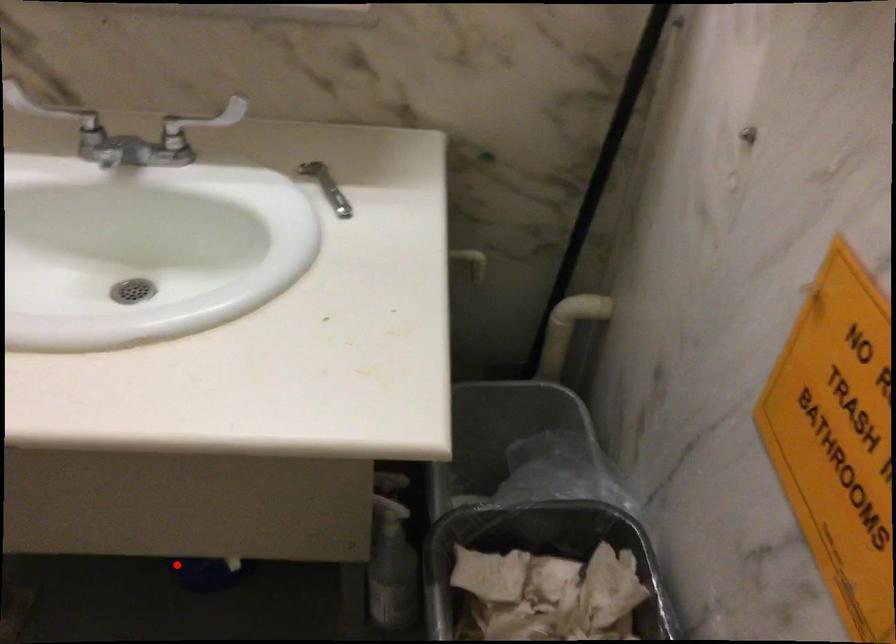
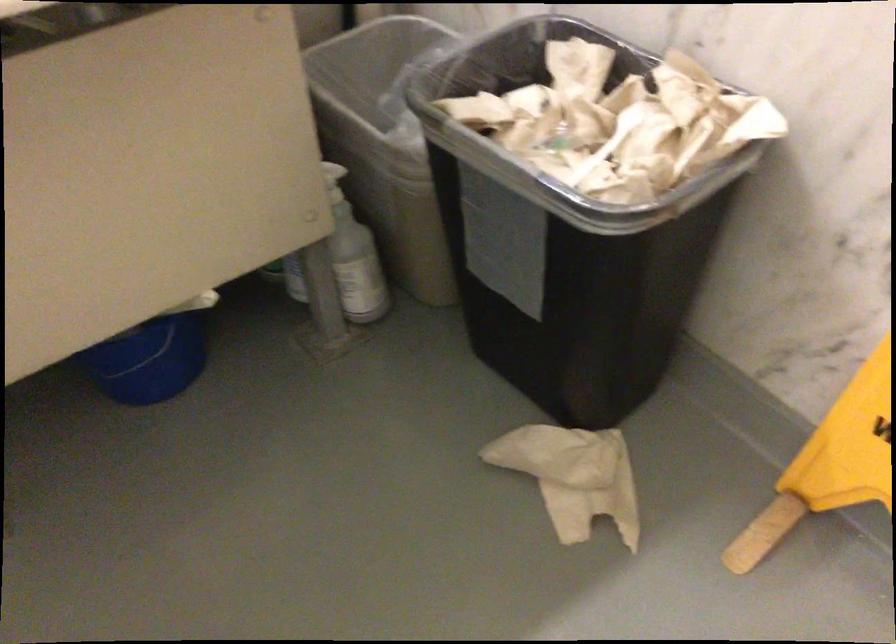
The point at the highlighted location is marked in the first image. Where is the corresponding point in the second image?

(149, 361)